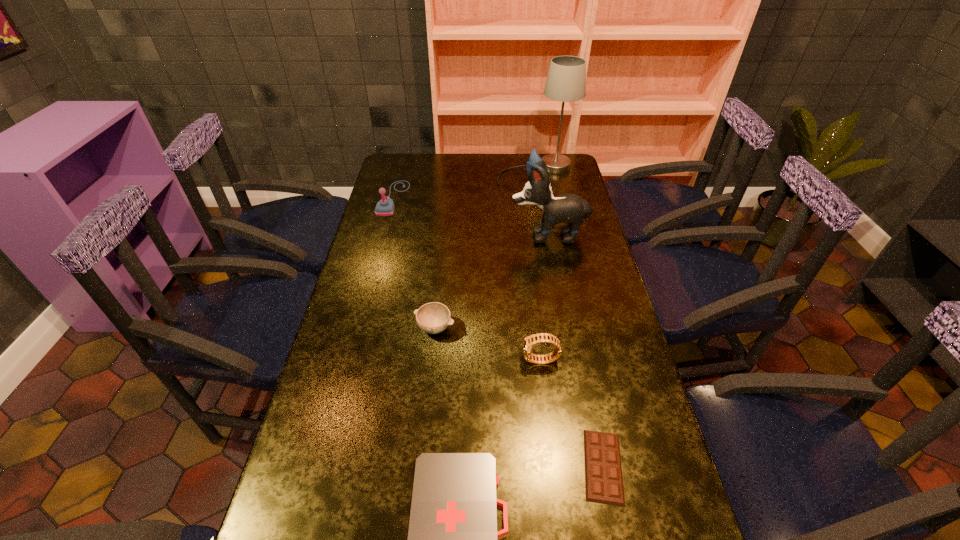
Locate an element on the screen. The width and height of the screenshot is (960, 540). free spot located 0.080m on the front-facing side of the puppy is located at coordinates (488, 235).

Identify the location of vacant region located on the front-facing side of the puppy. The height and width of the screenshot is (540, 960). (451, 235).

At what (x,y) coordinates should I click in order to perform the action: click on vacant space positioned on the right of the leftmost object. Please return your answer as a coordinate pair (x, y). The image size is (960, 540). Looking at the image, I should click on (477, 198).

Locate an element on the screen. The width and height of the screenshot is (960, 540). blank space located on the face of the third nearest object is located at coordinates [465, 361].

Image resolution: width=960 pixels, height=540 pixels. I want to click on vacant space positioned on the face of the third nearest object, so coord(383,361).

You are a GUI agent. You are given a task and a screenshot of the screen. Output one action in this format:
    pyautogui.click(x=<x>, y=<y>)
    Task: Click on the vacant area situated on the face of the third nearest object
    The height and width of the screenshot is (540, 960).
    Given the screenshot: What is the action you would take?
    (x=409, y=361)

The width and height of the screenshot is (960, 540). I want to click on free space located 0.110m on the front of the bowl, so click(430, 375).

What are the coordinates of `free space located on the back of the chocolate bar` in the screenshot? It's located at (571, 309).

Identify the location of table lamp present at the far edge. The width and height of the screenshot is (960, 540). (566, 82).

Locate an element on the screen. The image size is (960, 540). joystick located at the far edge is located at coordinates (385, 207).